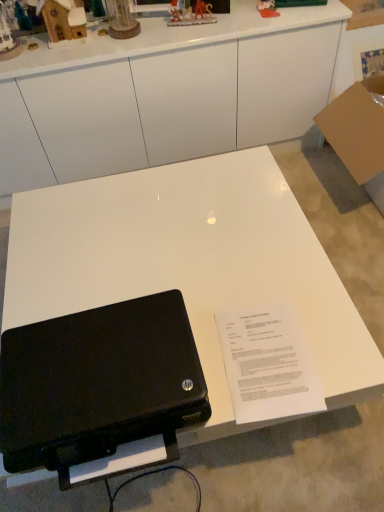
Question: Can you confirm if black matte laptop at lower left is bigger than plastic toy at upper center, which is the 5th toy in left-to-right order?

Choices:
 (A) no
 (B) yes

Answer: (B)

Question: From the image's perspective, would you say black matte laptop at lower left is shown under plastic toy at upper center, which is the 5th toy in left-to-right order?

Choices:
 (A) yes
 (B) no

Answer: (A)

Question: Does black matte laptop at lower left turn towards plastic toy at upper center, which ranks as the 1th toy in right-to-left order?

Choices:
 (A) yes
 (B) no

Answer: (B)

Question: From the image's perspective, is black matte laptop at lower left on plastic toy at upper center, which is the 5th toy in left-to-right order?

Choices:
 (A) no
 (B) yes

Answer: (A)

Question: Considering the relative sizes of black matte laptop at lower left and plastic toy at upper center, which ranks as the 1th toy in right-to-left order, in the image provided, is black matte laptop at lower left thinner than plastic toy at upper center, which ranks as the 1th toy in right-to-left order,?

Choices:
 (A) no
 (B) yes

Answer: (A)

Question: Is white glossy desk at center wider or thinner than white glossy table at center?

Choices:
 (A) thin
 (B) wide

Answer: (A)

Question: Relative to white glossy table at center, is white glossy desk at center in front or behind?

Choices:
 (A) front
 (B) behind

Answer: (B)

Question: From a real-world perspective, is white glossy desk at center positioned above or below white glossy table at center?

Choices:
 (A) above
 (B) below

Answer: (A)

Question: From the image's perspective, is white glossy desk at center above or below white glossy table at center?

Choices:
 (A) below
 (B) above

Answer: (B)

Question: Is matte wooden clock at upper center, the third toy when ordered from left to right, wider or thinner than wooden house at upper left, which ranks as the first toy in left-to-right order?

Choices:
 (A) thin
 (B) wide

Answer: (B)

Question: From a real-world perspective, is matte wooden clock at upper center, the third toy viewed from the right, physically located above or below wooden house at upper left, which ranks as the first toy in left-to-right order?

Choices:
 (A) above
 (B) below

Answer: (A)

Question: From the image's perspective, is matte wooden clock at upper center, the third toy viewed from the right, located above or below wooden house at upper left, the 5th toy in the right-to-left sequence?

Choices:
 (A) above
 (B) below

Answer: (A)

Question: Is matte wooden clock at upper center, the third toy viewed from the right, situated inside wooden house at upper left, which ranks as the first toy in left-to-right order, or outside?

Choices:
 (A) outside
 (B) inside

Answer: (A)

Question: Is wooden house at upper left, the fourth toy in the right-to-left sequence, bigger or smaller than white glossy table at center?

Choices:
 (A) big
 (B) small

Answer: (B)

Question: Looking at their shapes, would you say wooden house at upper left, which is counted as the second toy, starting from the left, is wider or thinner than white glossy table at center?

Choices:
 (A) wide
 (B) thin

Answer: (B)